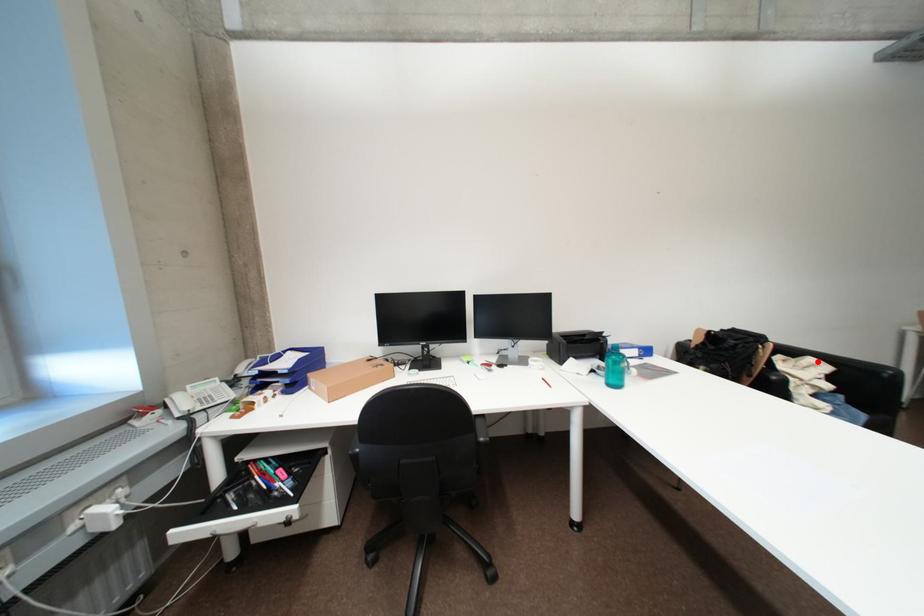
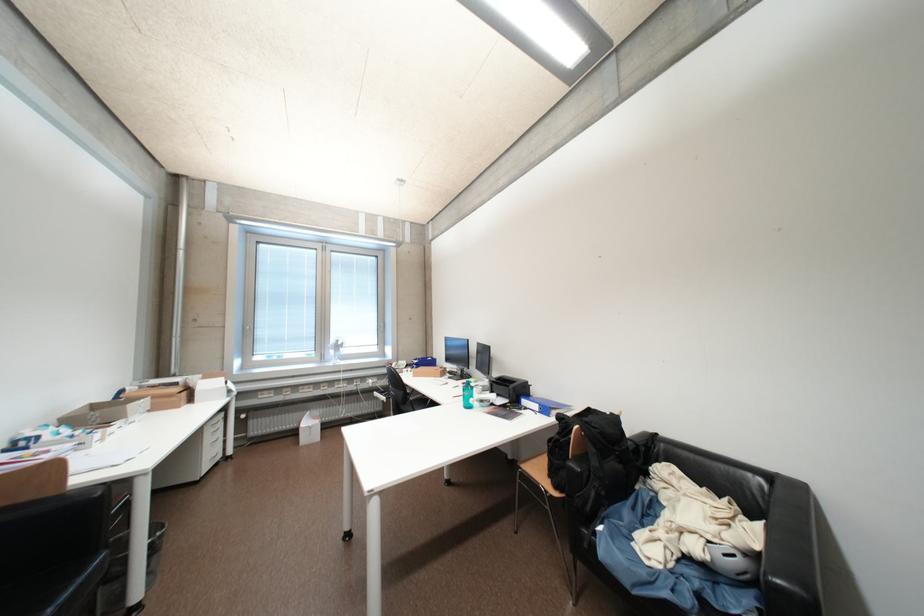
Find the pixel in the second image that matches the highlighted location in the first image.

(769, 528)